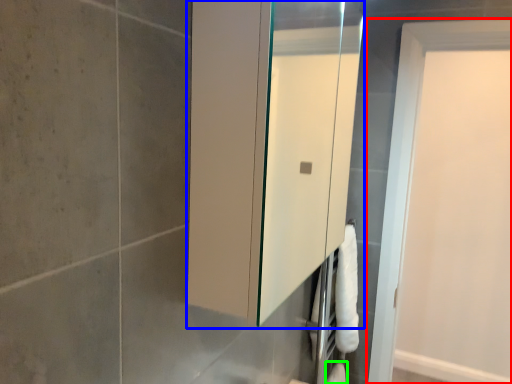
Question: Considering the real-world distances, which object is closest to door (highlighted by a red box)? medicine cabinet (highlighted by a blue box) or toilet paper (highlighted by a green box).

Choices:
 (A) medicine cabinet
 (B) toilet paper

Answer: (B)